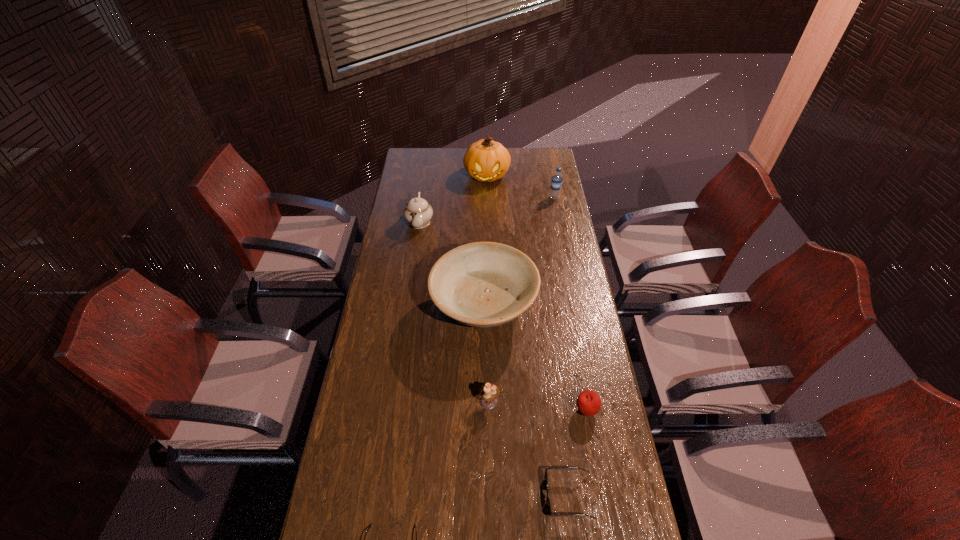
I want to click on the farthest object, so click(x=485, y=160).

Find the location of a particular element. pumpkin is located at coordinates (485, 160).

Where is `dish`? The width and height of the screenshot is (960, 540). dish is located at coordinates (483, 284).

What are the coordinates of `water bottle` in the screenshot? It's located at (556, 182).

You are a GUI agent. You are given a task and a screenshot of the screen. Output one action in this format:
    pyautogui.click(x=<x>, y=<y>)
    Task: Click on the third farthest object
    Image resolution: width=960 pixels, height=540 pixels.
    Given the screenshot: What is the action you would take?
    pyautogui.click(x=418, y=212)

Find the location of a particular element. This screenshot has width=960, height=540. candle holder is located at coordinates (489, 392).

Locate an element on the screen. The image size is (960, 540). apple is located at coordinates (588, 402).

Locate an element on the screen. The image size is (960, 540). the second nearest object is located at coordinates (559, 468).

I want to click on free space located 0.250m on the front face of the farthest object, so click(x=488, y=219).

Where is `free location located on the front of the fourth farthest object`? This screenshot has width=960, height=540. free location located on the front of the fourth farthest object is located at coordinates (485, 428).